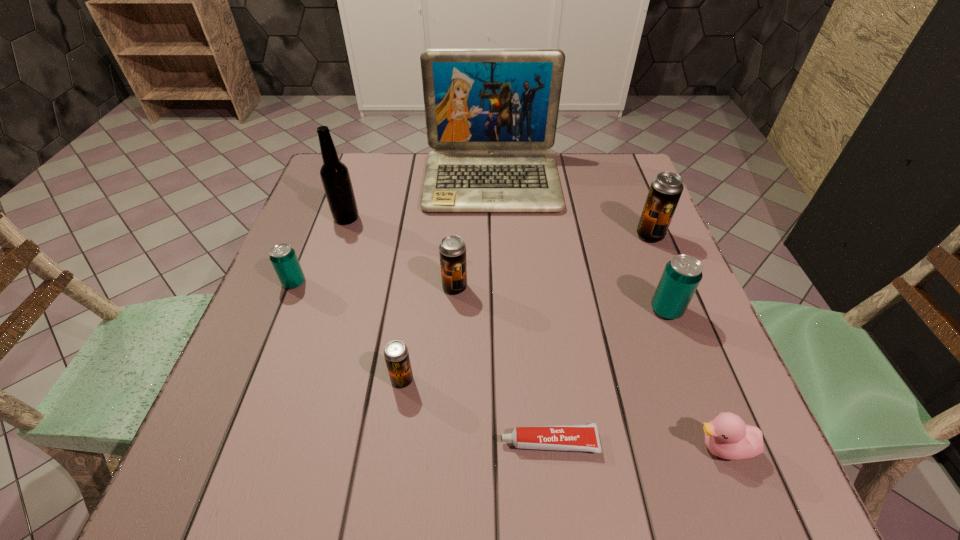
Where is `vacant space at the near left corner`? The image size is (960, 540). vacant space at the near left corner is located at coordinates (294, 464).

You are a GUI agent. You are given a task and a screenshot of the screen. Output one action in this format:
    pyautogui.click(x=<x>, y=<y>)
    Task: Click on the free space at the near right corner of the desktop
    The height and width of the screenshot is (540, 960).
    Given the screenshot: What is the action you would take?
    pyautogui.click(x=678, y=449)

Image resolution: width=960 pixels, height=540 pixels. I want to click on free point between the second shortest object and the farthest beer can, so click(686, 341).

I want to click on free space between the pink duckling and the leftmost beer can, so click(x=508, y=365).

Locate an element on the screen. empty location between the eighth shortest object and the tallest object is located at coordinates (420, 200).

You are a GUI agent. You are given a task and a screenshot of the screen. Output one action in this format:
    pyautogui.click(x=<x>, y=<y>)
    Task: Click on the free area in between the second tallest object and the second shortest object
    This screenshot has height=540, width=960.
    Given the screenshot: What is the action you would take?
    point(535,333)

Image resolution: width=960 pixels, height=540 pixels. Identify the location of empty space that is in between the leftmost object and the beer bottle. (321, 251).

Locate an element on the screen. unoccupied position between the third beer can from left to right and the laptop computer is located at coordinates (473, 234).

I want to click on empty space that is in between the laptop computer and the eighth shortest object, so click(x=420, y=200).

Image resolution: width=960 pixels, height=540 pixels. I want to click on free point between the sixth farthest object and the tallest object, so click(x=579, y=245).